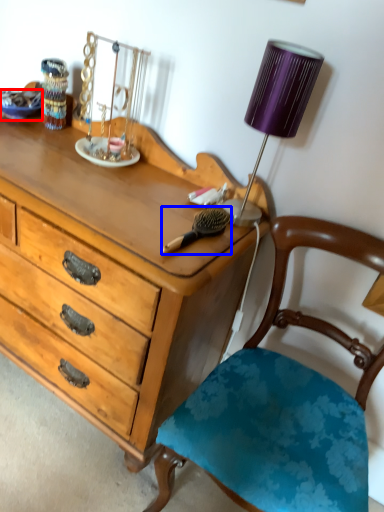
Question: Which object is closer to the camera taking this photo, plate (highlighted by a red box) or brush (highlighted by a blue box)?

Choices:
 (A) plate
 (B) brush

Answer: (B)